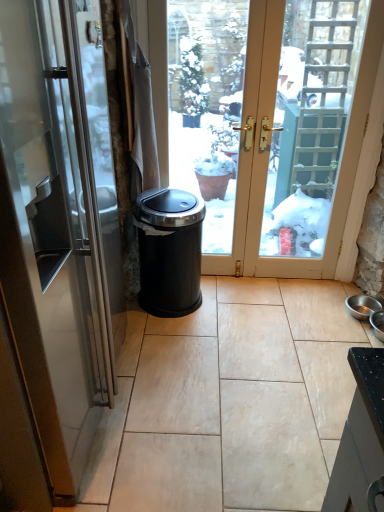
Question: Considering the relative positions of satin silver door at left and black plastic trash can at center in the image provided, is satin silver door at left to the left or to the right of black plastic trash can at center?

Choices:
 (A) left
 (B) right

Answer: (A)

Question: Is point (39, 153) positioned closer to the camera than point (172, 304)?

Choices:
 (A) closer
 (B) farther

Answer: (A)

Question: From the image's perspective, is satin silver door at left above or below black plastic trash can at center?

Choices:
 (A) below
 (B) above

Answer: (B)

Question: Is black plastic trash can at center bigger or smaller than satin silver door at left?

Choices:
 (A) big
 (B) small

Answer: (B)

Question: Would you say black plastic trash can at center is inside or outside satin silver door at left?

Choices:
 (A) inside
 (B) outside

Answer: (B)

Question: From a real-world perspective, relative to satin silver door at left, is black plastic trash can at center vertically above or below?

Choices:
 (A) above
 (B) below

Answer: (B)

Question: Based on their positions, is black plastic trash can at center located to the left or right of satin silver door at left?

Choices:
 (A) right
 (B) left

Answer: (A)